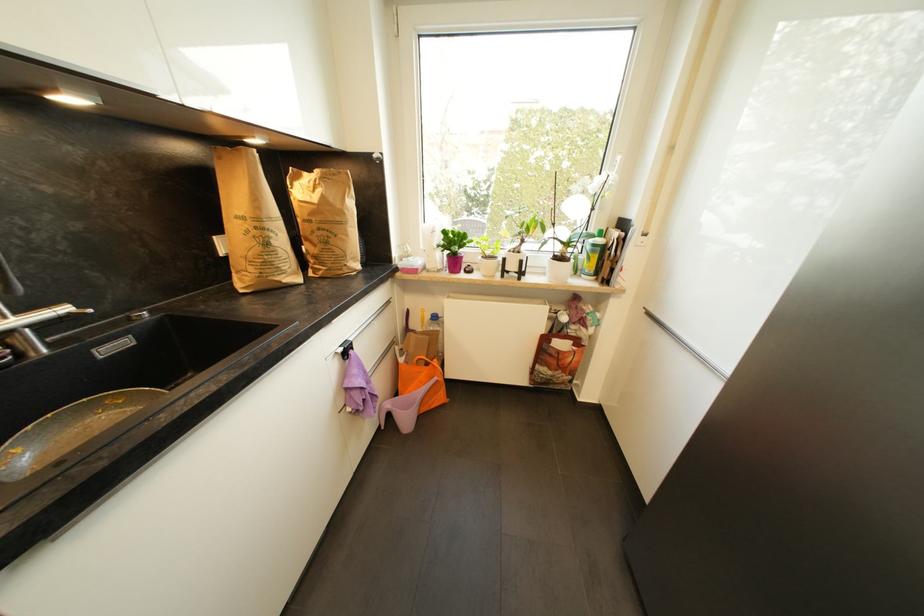
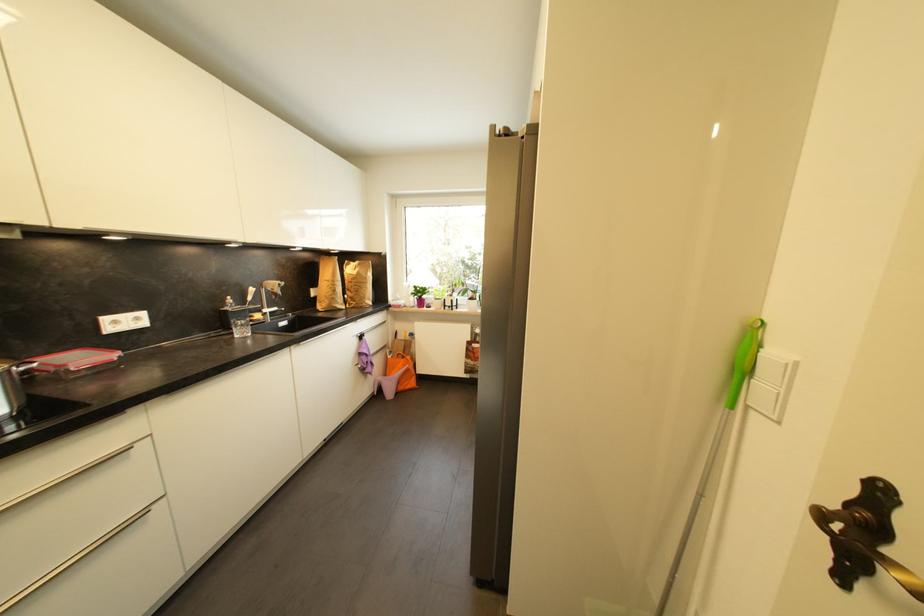
In the second image, find the point that corresponds to pixel 407 362 in the first image.

(395, 359)